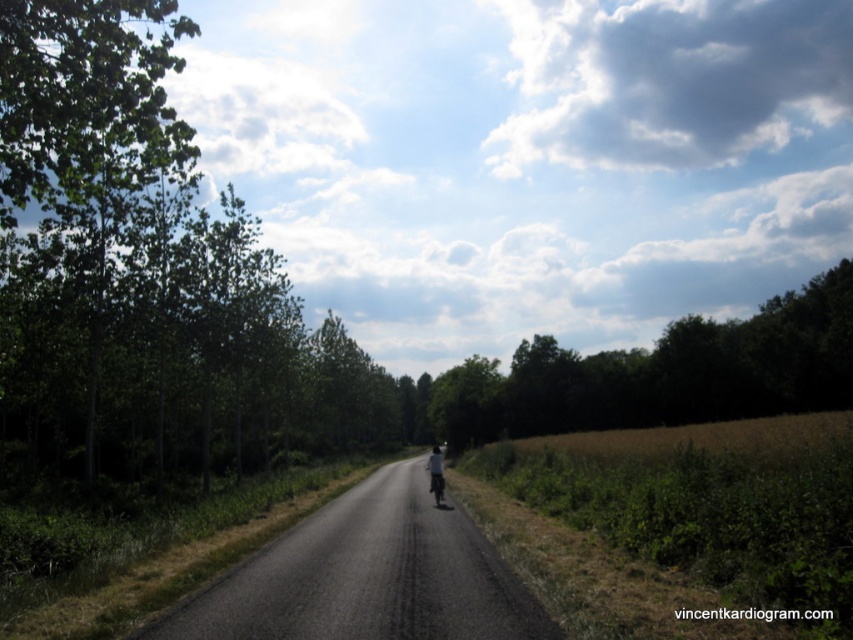
Between green leafy tree at upper center and dark gray fabric jacket at center, which one has more height?

Standing taller between the two is green leafy tree at upper center.

From the picture: Can you confirm if green leafy tree at upper center is taller than dark gray fabric jacket at center?

Yes.

Is point (547, 339) more distant than point (431, 483)?

Yes, point (547, 339) is farther from viewer.

Identify the location of green leafy tree at upper center. This screenshot has height=640, width=853. (660, 372).

Is point (61, 113) positioned behind point (440, 477)?

No, it is in front of (440, 477).

Who is more distant from viewer, (x=132, y=49) or (x=433, y=488)?

Point (x=433, y=488)

This screenshot has width=853, height=640. Identify the location of green leafy tree at upper left. [x=84, y=92].

Can you confirm if green leafy tree at upper left is bigger than dark gray fabric jacket at center?

Correct, green leafy tree at upper left is larger in size than dark gray fabric jacket at center.

Between green leafy tree at upper left and dark gray fabric jacket at center, which one appears on the right side from the viewer's perspective?

Positioned to the right is dark gray fabric jacket at center.

Between point (161, 19) and point (438, 474), which one is positioned behind?

Positioned behind is point (438, 474).

The height and width of the screenshot is (640, 853). Identify the location of green leafy tree at upper left. (84, 92).